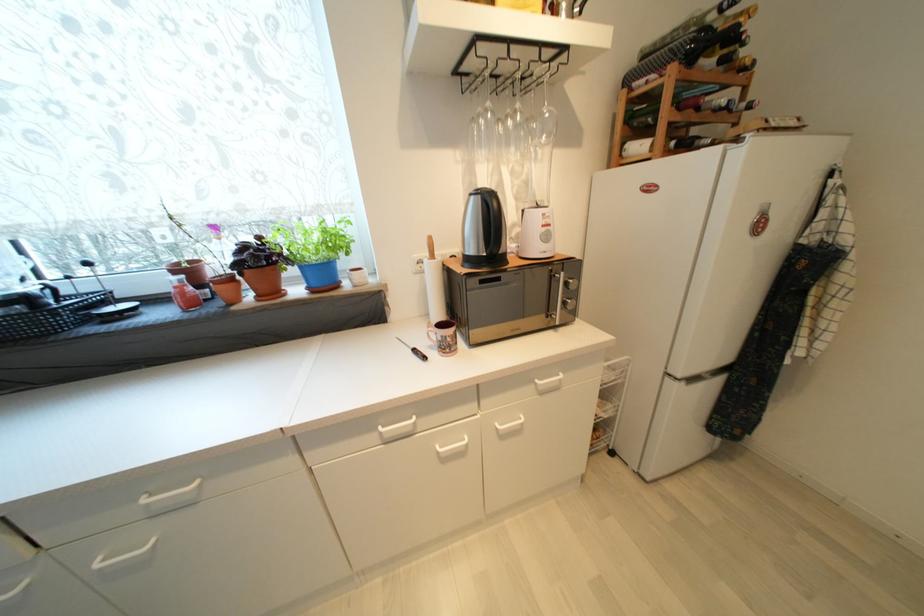
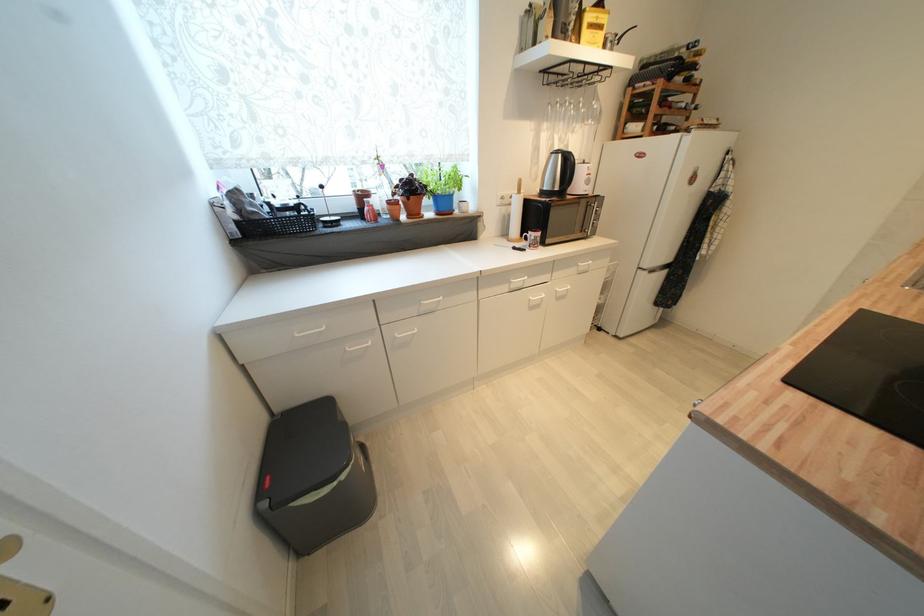
Find the pixel in the second image that matches pixel 683 119 in the first image.

(664, 114)